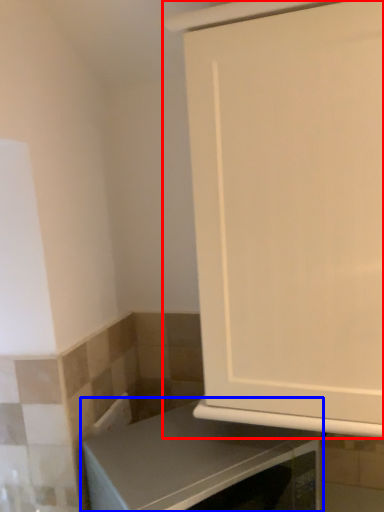
Question: Which object is closer to the camera taking this photo, cabinetry (highlighted by a red box) or countertop (highlighted by a blue box)?

Choices:
 (A) cabinetry
 (B) countertop

Answer: (A)